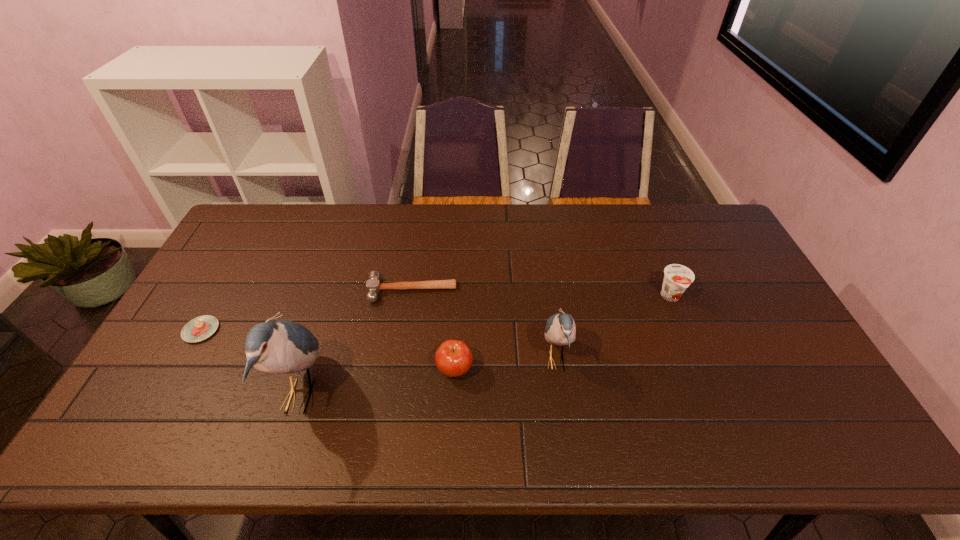
This screenshot has width=960, height=540. I want to click on vacant space at the right edge of the desktop, so click(x=815, y=373).

Locate an element on the screen. The width and height of the screenshot is (960, 540). free space at the far left corner of the desktop is located at coordinates (284, 221).

This screenshot has width=960, height=540. Identify the location of vacant region at the far right corner of the desktop. (704, 240).

Where is `free area in between the shorter bird and the leftmost object`? free area in between the shorter bird and the leftmost object is located at coordinates (378, 345).

Identify the location of empty space that is in between the second shortest object and the yogurt. The image size is (960, 540). (541, 294).

Locate an element on the screen. vacant area between the yogurt and the fifth tallest object is located at coordinates (541, 294).

At what (x,y) coordinates should I click in order to perform the action: click on vacant area that lies between the fifth tallest object and the apple. Please return your answer as a coordinate pair (x, y). This screenshot has height=540, width=960. Looking at the image, I should click on (433, 330).

Find the location of `unoccupied position between the left bird and the second tallest object`. unoccupied position between the left bird and the second tallest object is located at coordinates (428, 377).

The image size is (960, 540). I want to click on free point between the rightmost object and the leftmost object, so click(436, 314).

At what (x,y) coordinates should I click in order to perform the action: click on vacant space in between the right bird and the rightmost object. Please return your answer as a coordinate pair (x, y). Image resolution: width=960 pixels, height=540 pixels. Looking at the image, I should click on (613, 328).